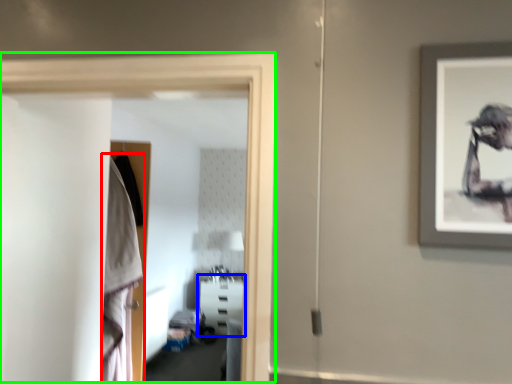
Question: Based on their relative distances, which object is nearer to robe (highlighted by a red box)? Choose from furniture (highlighted by a blue box) and glass door (highlighted by a green box).

Choices:
 (A) furniture
 (B) glass door

Answer: (B)